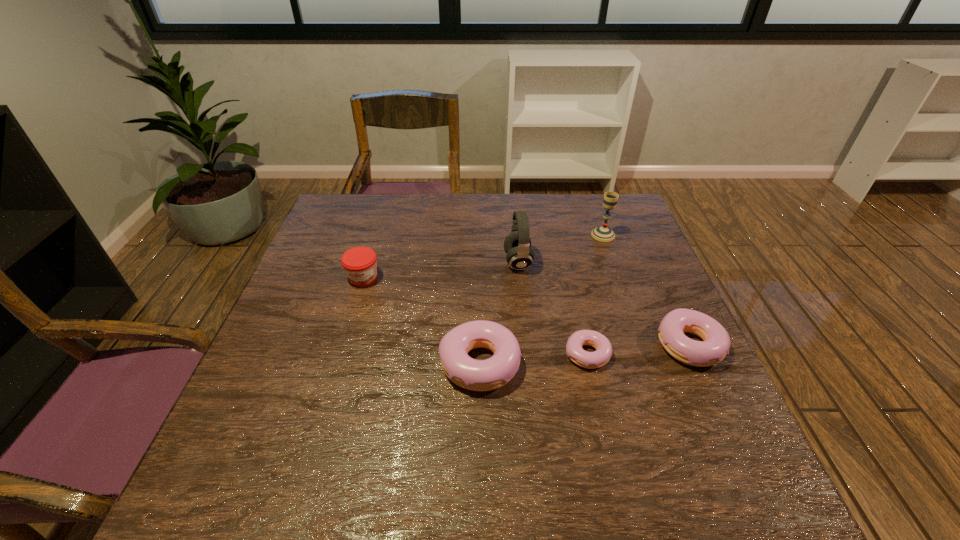
In order to click on object positioned at the far right corner in this screenshot , I will do [603, 233].

You are a GUI agent. You are given a task and a screenshot of the screen. Output one action in this format:
    pyautogui.click(x=<x>, y=<y>)
    Task: Click on the blank area at the far edge
    This screenshot has height=540, width=960.
    Given the screenshot: What is the action you would take?
    pyautogui.click(x=441, y=202)

In the image, there is a desktop. At what (x,y) coordinates should I click in order to perform the action: click on vacant area at the near edge. Please return your answer as a coordinate pair (x, y). The width and height of the screenshot is (960, 540). Looking at the image, I should click on (380, 407).

Identify the location of vacant space at the left edge of the desktop. The width and height of the screenshot is (960, 540). (308, 262).

In the image, there is a desktop. At what (x,y) coordinates should I click in order to perform the action: click on vacant space at the right edge. Please return your answer as a coordinate pair (x, y). The image size is (960, 540). Looking at the image, I should click on (613, 259).

In the image, there is a desktop. Where is `free region at the far left corner`? free region at the far left corner is located at coordinates (370, 201).

Locate an element on the screen. vacant space at the far right corner of the desktop is located at coordinates (627, 234).

Locate an element on the screen. vacant space that's between the second doughnut from right to left and the rightmost doughnut is located at coordinates (638, 350).

The image size is (960, 540). Find the location of `vacant region between the shortest doughnut and the jam`. vacant region between the shortest doughnut and the jam is located at coordinates (475, 316).

The image size is (960, 540). In order to click on free space between the shortest object and the leftmost doughnut in this screenshot , I will do `click(534, 358)`.